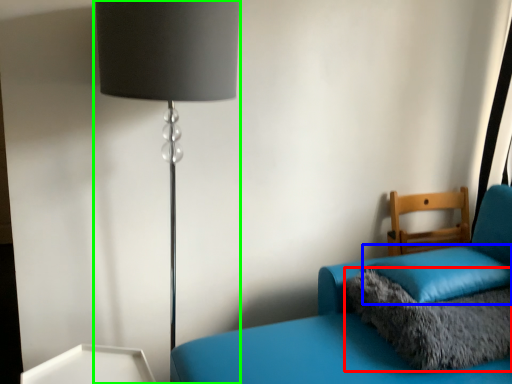
Question: Estimate the real-world distances between objects in this image. Which object is farther from pillow (highlighted by a red box), pillow (highlighted by a blue box) or lamp (highlighted by a green box)?

Choices:
 (A) pillow
 (B) lamp

Answer: (B)